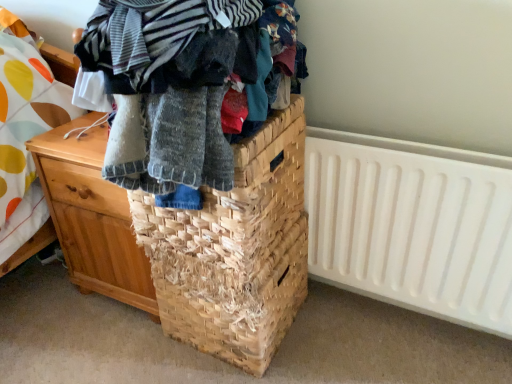
In order to click on knitted wool sweater at center in this screenshot , I will do `click(180, 83)`.

I want to click on wooden chest of drawers at left, so click(x=92, y=216).

What do you see at coordinates (234, 250) in the screenshot?
I see `natural fiber basket at center` at bounding box center [234, 250].

In order to click on knitted wool sweater at center in this screenshot , I will do `click(180, 83)`.

Is white plastic radiator at right looking in the opposite direction of knitted wool sweater at center?

No, white plastic radiator at right is not facing the opposite direction of knitted wool sweater at center.

From the image's perspective, would you say white plastic radiator at right is shown under knitted wool sweater at center?

Yes, from the image's perspective, white plastic radiator at right is beneath knitted wool sweater at center.

Who is taller, white plastic radiator at right or knitted wool sweater at center?

white plastic radiator at right is taller.

Is white plastic radiator at right closer to camera compared to knitted wool sweater at center?

No, it is behind knitted wool sweater at center.

From a real-world perspective, relative to natural fiber basket at center, is knitted wool sweater at center vertically above or below?

knitted wool sweater at center is situated higher than natural fiber basket at center in the real world.

Relative to natural fiber basket at center, is knitted wool sweater at center in front or behind?

Visually, knitted wool sweater at center is located in front of natural fiber basket at center.

Is knitted wool sweater at center aimed at natural fiber basket at center?

No.

Can you tell me how much knitted wool sweater at center and wooden chest of drawers at left differ in facing direction?

The angle between the facing direction of knitted wool sweater at center and the facing direction of wooden chest of drawers at left is 4.13e-05 degrees.

Identify the location of clothing above the wooden chest of drawers at left (from a real-world perspective). (180, 83).

Does knitted wool sweater at center turn towards wooden chest of drawers at left?

No, knitted wool sweater at center is not aimed at wooden chest of drawers at left.

Could wooden chest of drawers at left be considered to be inside knitted wool sweater at center?

No, wooden chest of drawers at left is located outside of knitted wool sweater at center.

Would you say wooden chest of drawers at left is a long distance from knitted wool sweater at center?

No, wooden chest of drawers at left is in close proximity to knitted wool sweater at center.

Does wooden chest of drawers at left turn towards knitted wool sweater at center?

No, wooden chest of drawers at left is not oriented towards knitted wool sweater at center.

Is point (81, 178) farther from camera compared to point (81, 63)?

That is True.

Who is bigger, natural fiber basket at center or white plastic radiator at right?

Bigger between the two is natural fiber basket at center.

Can you confirm if natural fiber basket at center is positioned to the right of white plastic radiator at right?

No, natural fiber basket at center is not to the right of white plastic radiator at right.

Is there a large distance between natural fiber basket at center and white plastic radiator at right?

No, natural fiber basket at center is not far away from white plastic radiator at right.

In the scene shown: Which of these two, wooden chest of drawers at left or natural fiber basket at center, stands taller?

With more height is wooden chest of drawers at left.

What are the coordinates of `the chest of drawers that is behind the natural fiber basket at center` in the screenshot? It's located at (92, 216).

Considering the relative positions of wooden chest of drawers at left and natural fiber basket at center in the image provided, is wooden chest of drawers at left to the left or to the right of natural fiber basket at center?

Based on their positions, wooden chest of drawers at left is located to the left of natural fiber basket at center.

Considering the relative sizes of wooden chest of drawers at left and natural fiber basket at center in the image provided, is wooden chest of drawers at left smaller than natural fiber basket at center?

No.

Considering the relative sizes of wooden chest of drawers at left and white plastic radiator at right in the image provided, is wooden chest of drawers at left thinner than white plastic radiator at right?

Incorrect, the width of wooden chest of drawers at left is not less than that of white plastic radiator at right.

Between point (71, 212) and point (374, 221), which one is positioned behind?

Positioned behind is point (71, 212).

From the image's perspective, which object appears higher, wooden chest of drawers at left or white plastic radiator at right?

wooden chest of drawers at left, from the image's perspective.

Between wooden chest of drawers at left and white plastic radiator at right, which one has larger size?

wooden chest of drawers at left.

Find the location of a particular element. This screenshot has height=384, width=512. clothing to the left of white plastic radiator at right is located at coordinates (180, 83).

In order to click on clothing above the natural fiber basket at center (from a real-world perspective) in this screenshot , I will do `click(180, 83)`.

Which object lies nearer to the anchor point knitted wool sweater at center, natural fiber basket at center or white plastic radiator at right?

Based on the image, natural fiber basket at center appears to be nearer to knitted wool sweater at center.

When comparing their distances from natural fiber basket at center, does wooden chest of drawers at left or white plastic radiator at right seem further?

Based on the image, white plastic radiator at right appears to be further to natural fiber basket at center.

Which object lies nearer to the anchor point white plastic radiator at right, natural fiber basket at center or knitted wool sweater at center?

natural fiber basket at center is positioned closer to the anchor white plastic radiator at right.

Considering their positions, is white plastic radiator at right positioned further to wooden chest of drawers at left than natural fiber basket at center?

white plastic radiator at right.

Consider the image. Looking at the image, which one is located further to white plastic radiator at right, knitted wool sweater at center or natural fiber basket at center?

knitted wool sweater at center is further to white plastic radiator at right.

Which object lies nearer to the anchor point knitted wool sweater at center, white plastic radiator at right or wooden chest of drawers at left?

wooden chest of drawers at left is positioned closer to the anchor knitted wool sweater at center.

When comparing their distances from knitted wool sweater at center, does wooden chest of drawers at left or natural fiber basket at center seem closer?

Based on the image, natural fiber basket at center appears to be nearer to knitted wool sweater at center.

Considering their positions, is white plastic radiator at right positioned closer to natural fiber basket at center than wooden chest of drawers at left?

wooden chest of drawers at left is positioned closer to the anchor natural fiber basket at center.

Where is `chest of drawers between knitted wool sweater at center and natural fiber basket at center from top to bottom`? chest of drawers between knitted wool sweater at center and natural fiber basket at center from top to bottom is located at coordinates (92, 216).

This screenshot has height=384, width=512. In order to click on basket situated between knitted wool sweater at center and white plastic radiator at right from left to right in this screenshot , I will do `click(234, 250)`.

The image size is (512, 384). I want to click on clothing situated between wooden chest of drawers at left and white plastic radiator at right from left to right, so click(x=180, y=83).

The width and height of the screenshot is (512, 384). What are the coordinates of `basket between wooden chest of drawers at left and white plastic radiator at right` in the screenshot? It's located at (234, 250).